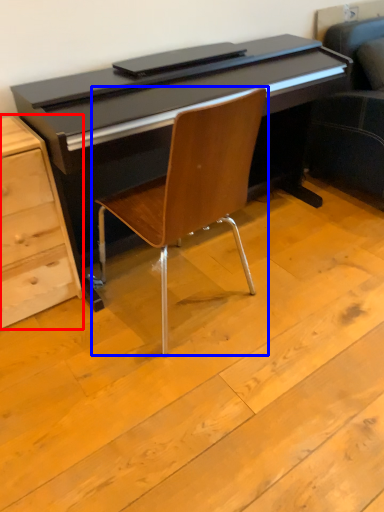
Question: Which point is further to the camera, chest of drawers (highlighted by a red box) or chair (highlighted by a blue box)?

Choices:
 (A) chest of drawers
 (B) chair

Answer: (A)